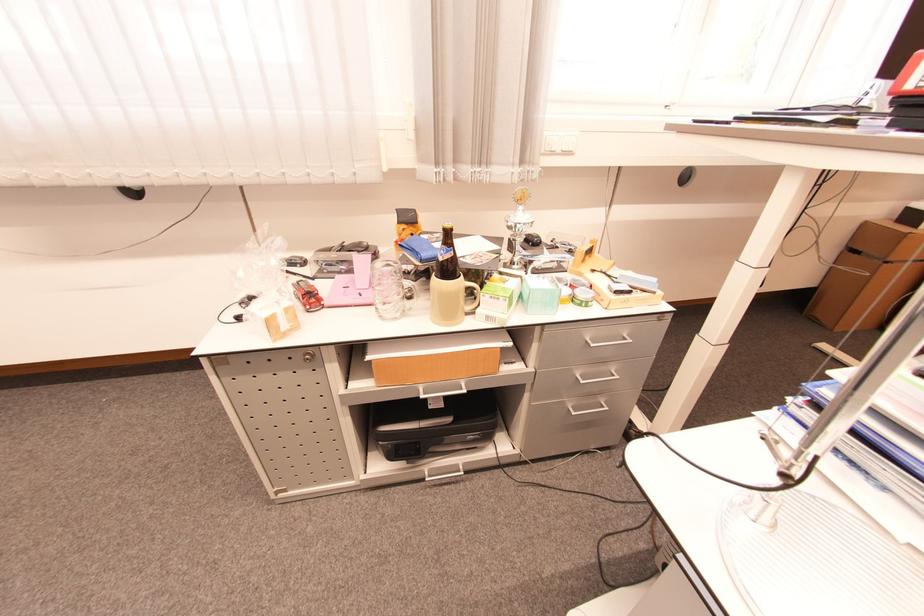
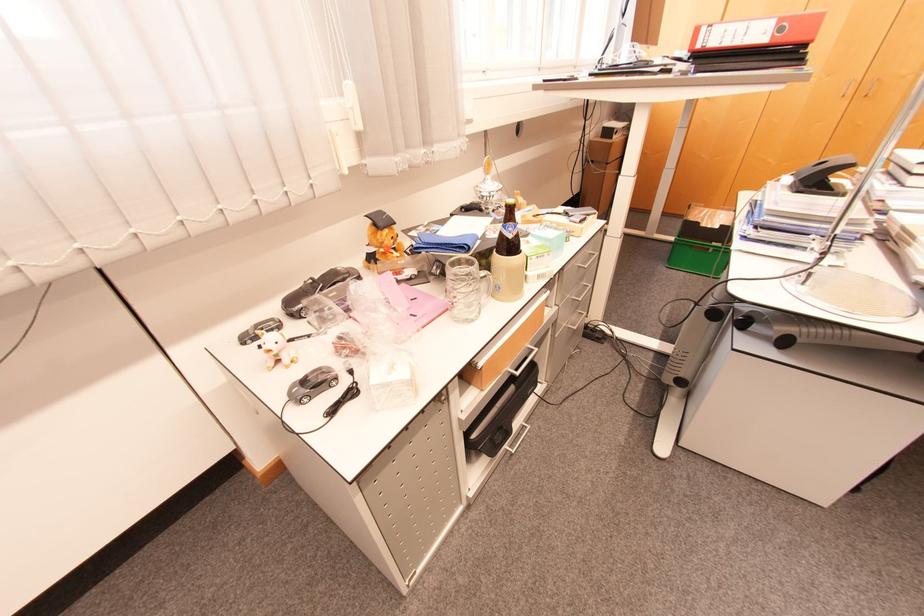
Question: Based on the continuous images, in which direction is the camera rotating? Reply with the corresponding letter.

Choices:
 (A) Left
 (B) Right
 (C) Up
 (D) Down

Answer: (B)